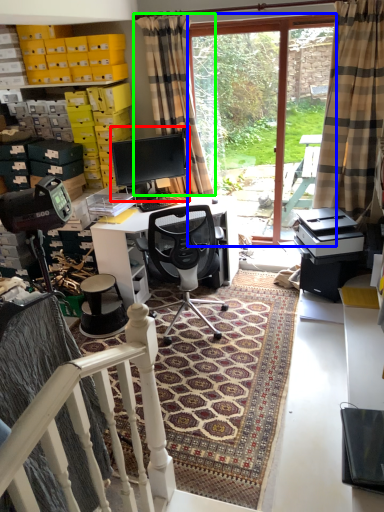
Question: Which object is positioned closest to computer monitor (highlighted by a red box)? Select from bay window (highlighted by a blue box) and curtain (highlighted by a green box).

Choices:
 (A) bay window
 (B) curtain

Answer: (B)